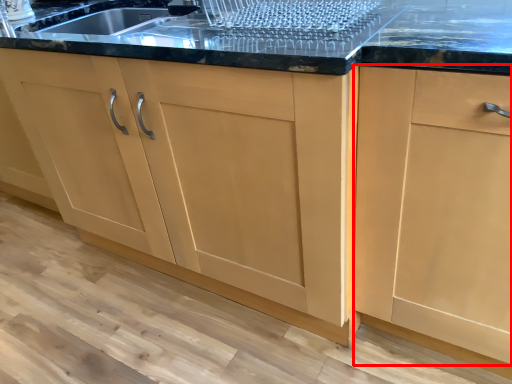
Question: From the image, what is the correct spatial relationship of cabinetry (annotated by the red box) in relation to cabinetry?

Choices:
 (A) left
 (B) right

Answer: (B)